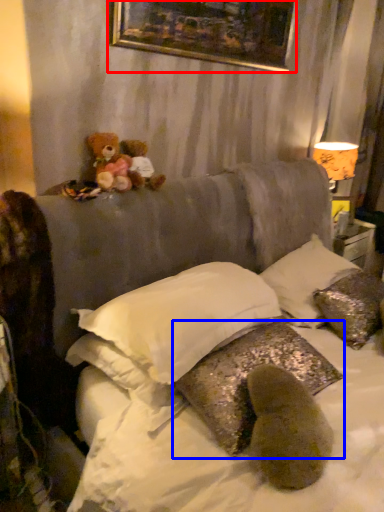
Question: Which object is closer to the camera taking this photo, picture frame (highlighted by a red box) or pillow (highlighted by a blue box)?

Choices:
 (A) picture frame
 (B) pillow

Answer: (B)